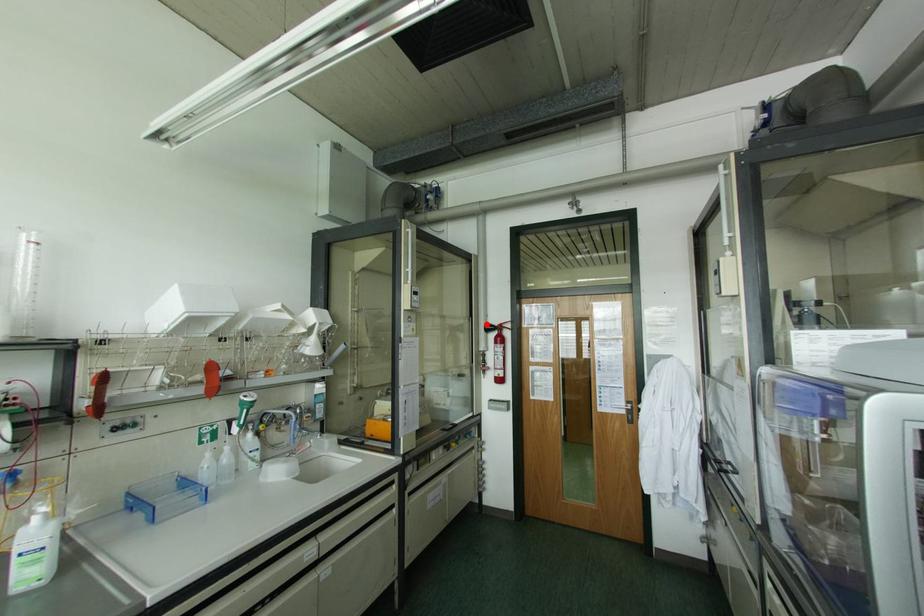
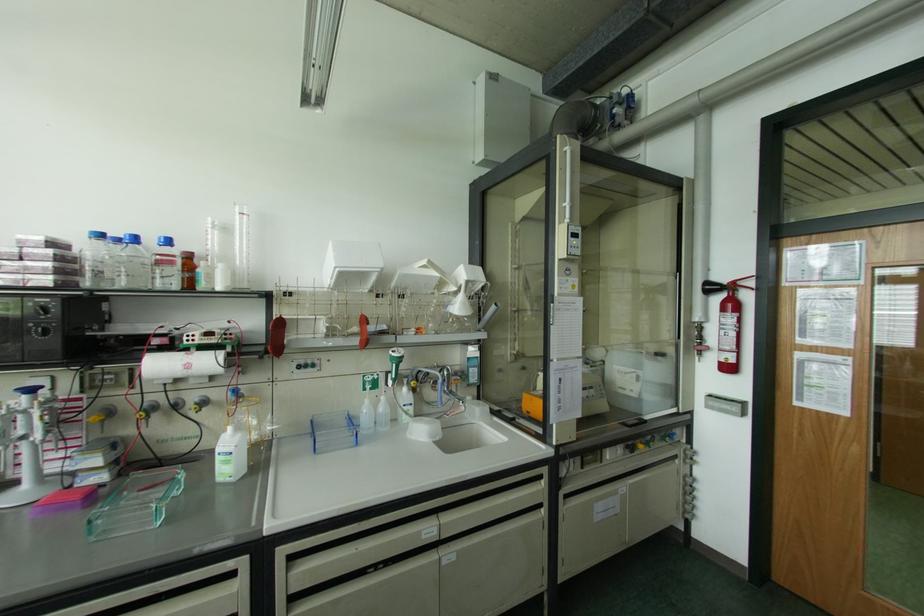
In the second image, find the point that corresponds to the highlighted location in the first image.

(707, 283)